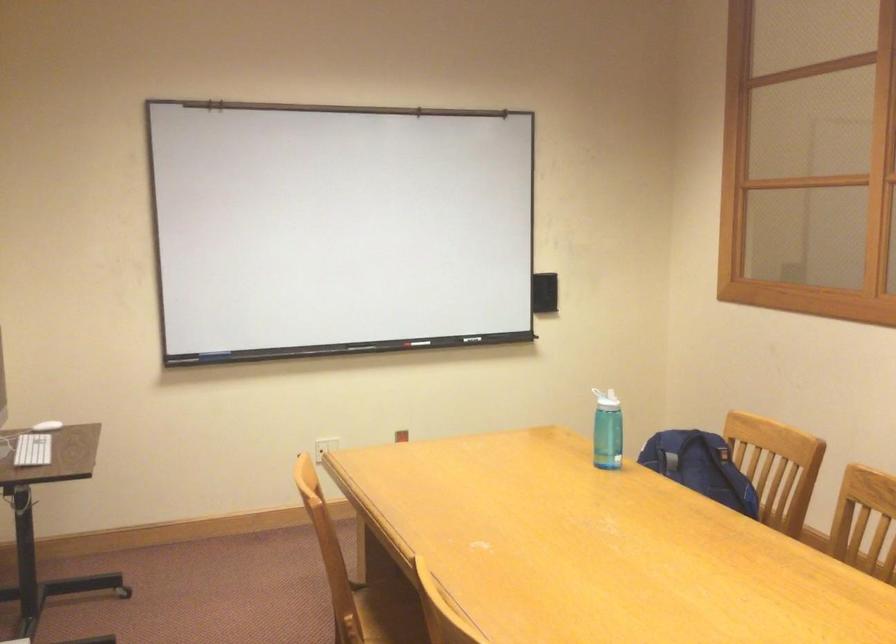
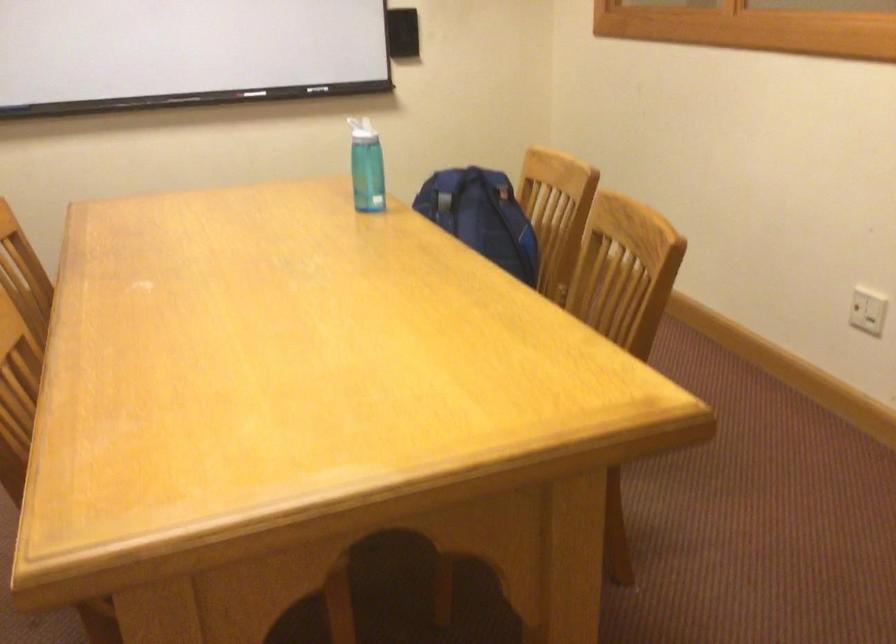
Question: In a continuous first-person perspective shot, in which direction is the camera moving?

Choices:
 (A) Left
 (B) Right
 (C) Forward
 (D) Backward

Answer: (B)